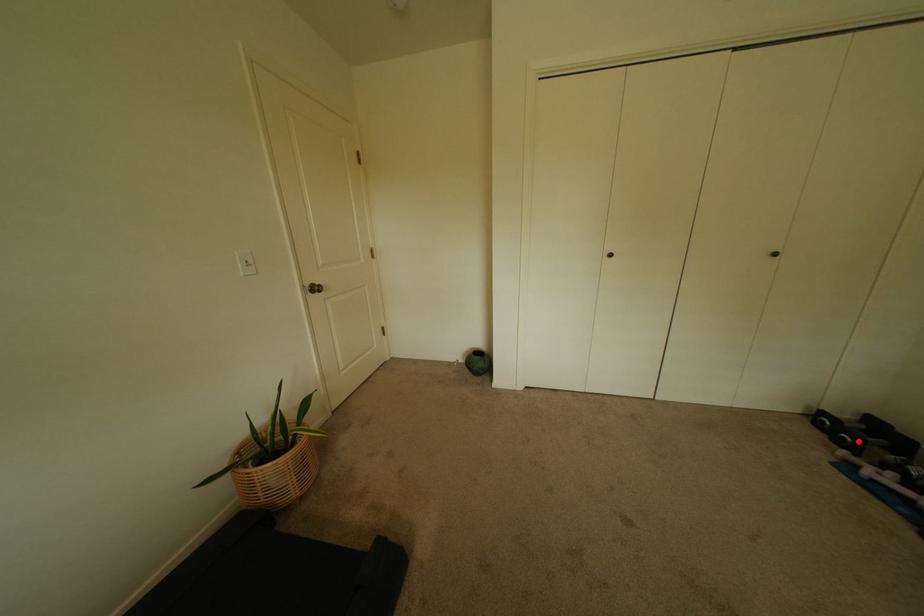
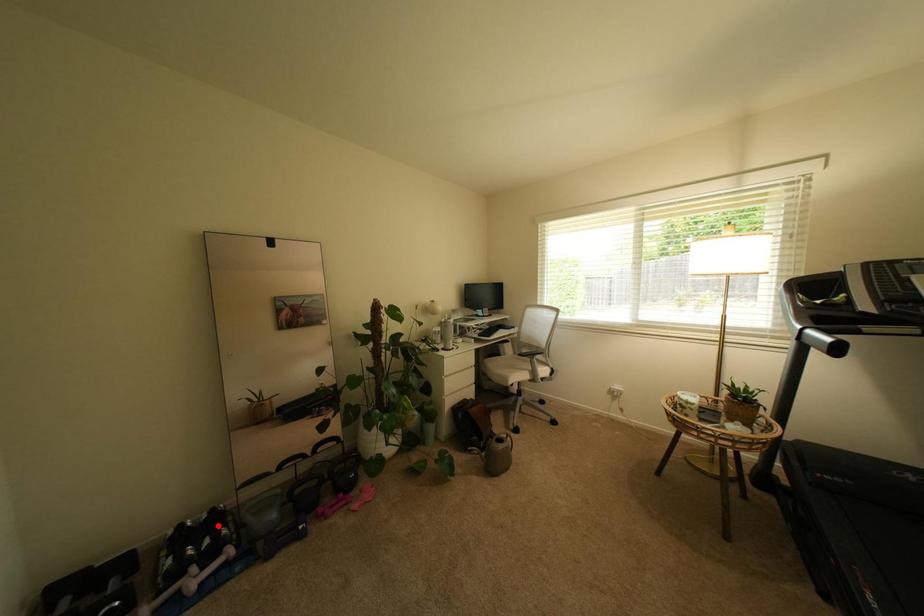
I am providing you with two images of the same scene from different viewpoints. A red point is marked on the first image and another point is marked on the second image. Is the marked point in image1 the same physical position as the marked point in image2?

No